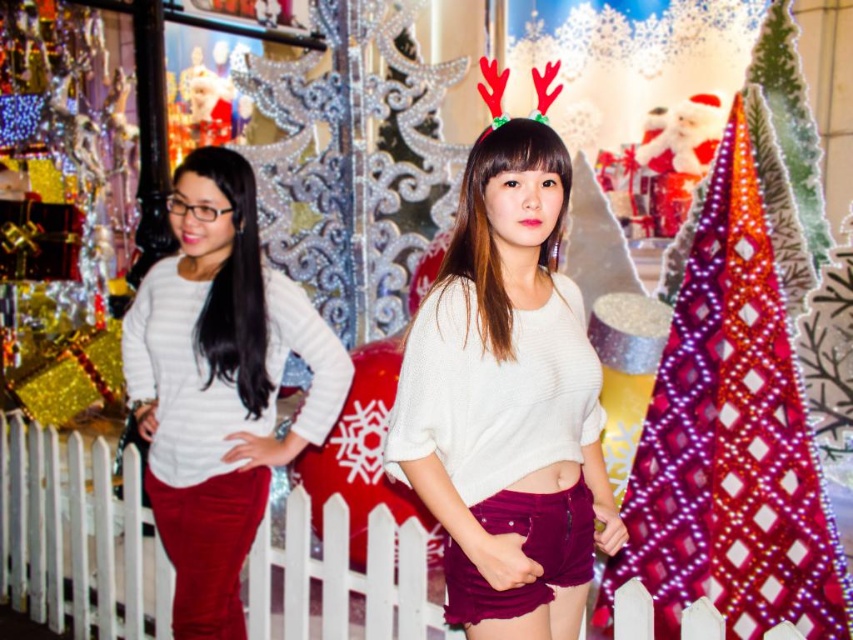
Question: Observing the image, what is the correct spatial positioning of velvet burgundy shorts at center in reference to white matte sweater at center?

Choices:
 (A) above
 (B) below

Answer: (A)

Question: Estimate the real-world distances between objects in this image. Which object is closer to the shiny metallic christmas tree at right?

Choices:
 (A) white matte sweater at center
 (B) velvet burgundy shorts at center

Answer: (B)

Question: Based on their relative distances, which object is nearer to the white matte sweater at center?

Choices:
 (A) velvet burgundy shorts at center
 (B) shiny metallic christmas tree at right

Answer: (A)

Question: Can you confirm if velvet burgundy shorts at center is positioned above white matte sweater at center?

Choices:
 (A) yes
 (B) no

Answer: (A)

Question: Considering the real-world distances, which object is farthest from the shiny metallic christmas tree at right?

Choices:
 (A) velvet burgundy shorts at center
 (B) white matte sweater at center

Answer: (B)

Question: Does shiny metallic christmas tree at right have a smaller size compared to white matte sweater at center?

Choices:
 (A) yes
 (B) no

Answer: (B)